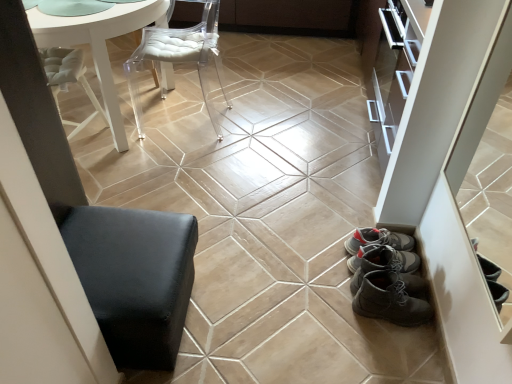
This screenshot has height=384, width=512. What are the coordinates of `free spot to the left of transparent acrylic chair at upper center` in the screenshot? It's located at (131, 124).